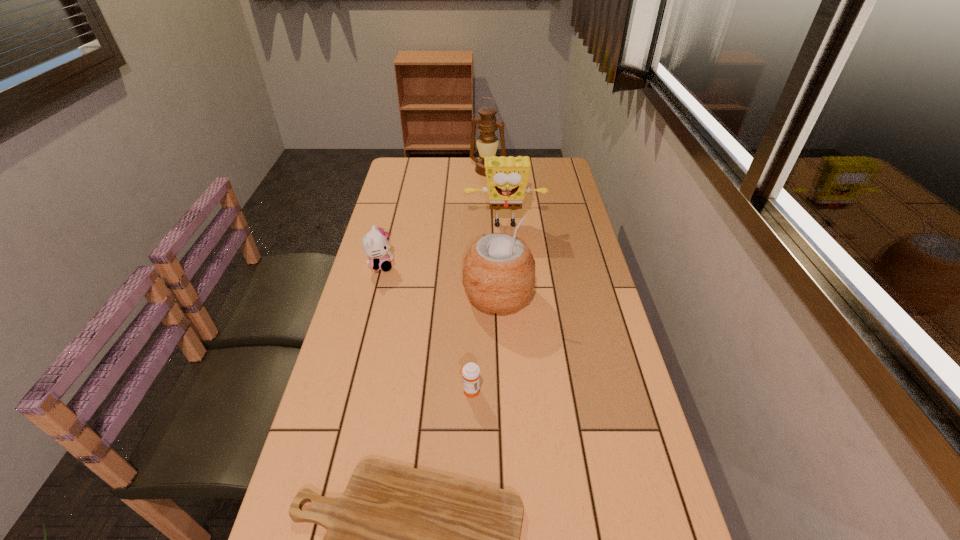
Where is `vacant space located 0.360m on the front-facing side of the fourth tallest object`? vacant space located 0.360m on the front-facing side of the fourth tallest object is located at coordinates (505, 265).

Identify the location of vacant position located 0.290m on the front of the second shortest object. The image size is (960, 540). (468, 530).

The image size is (960, 540). I want to click on object that is at the far edge, so click(487, 142).

This screenshot has width=960, height=540. I want to click on object situated at the left edge, so click(x=375, y=244).

The height and width of the screenshot is (540, 960). I want to click on object that is at the right edge, so pyautogui.click(x=507, y=177).

Find the location of `free region at the far edge of the desktop`. free region at the far edge of the desktop is located at coordinates (461, 181).

Identify the location of free region at the left edge. (414, 225).

Locate an element on the screen. vacant space at the right edge of the desktop is located at coordinates (609, 524).

Locate an element on the screen. vacant space that's between the kitten and the coconut is located at coordinates (440, 280).

This screenshot has height=540, width=960. Find the location of `free space between the farthest object and the fourth tallest object`. free space between the farthest object and the fourth tallest object is located at coordinates (434, 218).